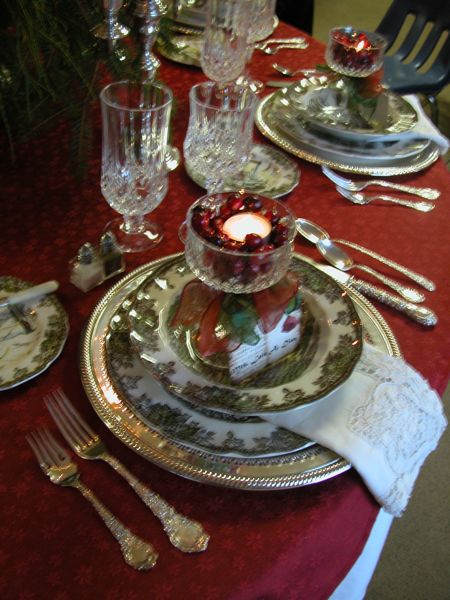
Where is `chair`? chair is located at coordinates (445, 58), (300, 17).